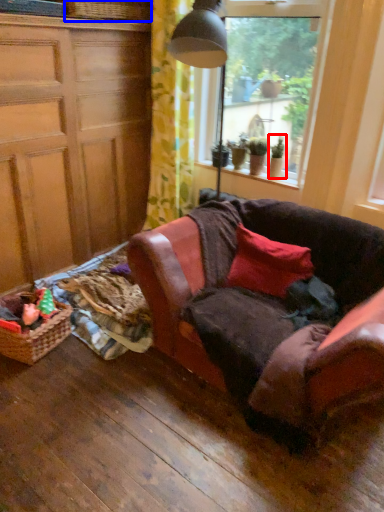
Question: Among these objects, which one is farthest to the camera, houseplant (highlighted by a red box) or basket (highlighted by a blue box)?

Choices:
 (A) houseplant
 (B) basket

Answer: (A)